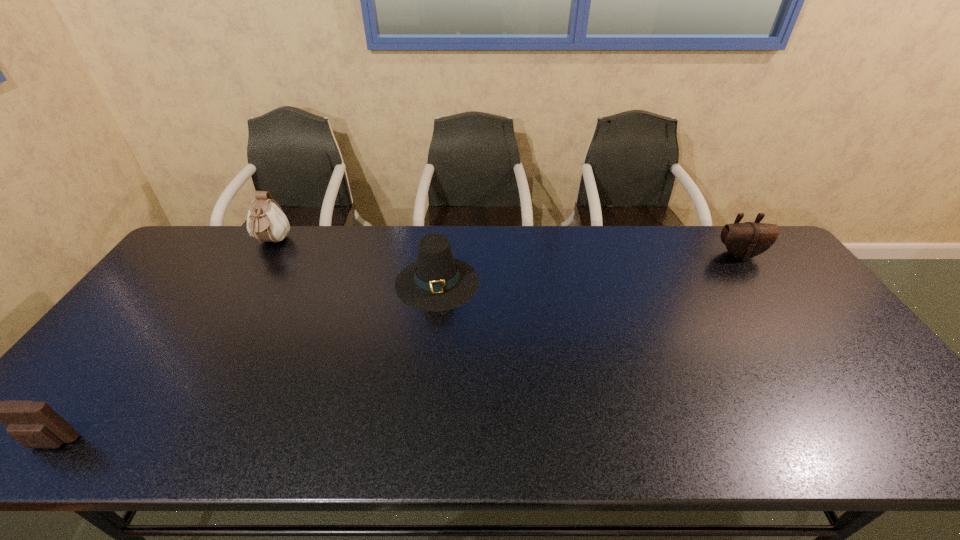
Identify the location of free area in between the rightmost object and the nearest pouch. Image resolution: width=960 pixels, height=540 pixels. (396, 349).

Find the location of a particular element. This screenshot has width=960, height=540. vacant region between the tallest pouch and the second object from right to left is located at coordinates point(354,262).

Find the location of `vacant space that's between the leftmost pouch and the rightmost pouch`. vacant space that's between the leftmost pouch and the rightmost pouch is located at coordinates (396, 349).

Locate an element on the screen. Image resolution: width=960 pixels, height=540 pixels. free space between the second pouch from right to left and the rightmost pouch is located at coordinates (506, 248).

Identify the location of vacant point located between the rightmost pouch and the tallest pouch. (506, 248).

Image resolution: width=960 pixels, height=540 pixels. What are the coordinates of `vacant space that is in between the third object from right to left and the rightmost pouch` in the screenshot? It's located at (506, 248).

Image resolution: width=960 pixels, height=540 pixels. I want to click on free space between the tallest pouch and the nearest object, so click(x=161, y=343).

What are the coordinates of `free space between the second pouch from left to right and the second object from right to left` in the screenshot? It's located at (354, 262).

This screenshot has height=540, width=960. What are the coordinates of `vacant area between the rightmost object and the hat` in the screenshot? It's located at (588, 268).

Choose which object is the nearest neighbor to the tallest pouch. Please provide its 2D coordinates. Your answer should be formatted as a tuple, i.e. [(x, y)], where the tuple contains the x and y coordinates of a point satisfying the conditions above.

[(436, 281)]